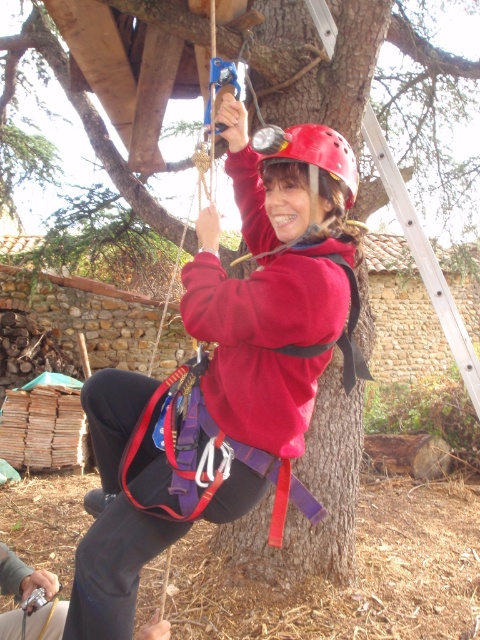
Question: Does matte red jacket at center have a lesser width compared to red matte helmet at center?

Choices:
 (A) yes
 (B) no

Answer: (B)

Question: Does matte red jacket at center have a smaller size compared to red matte helmet at center?

Choices:
 (A) yes
 (B) no

Answer: (B)

Question: Which point is farther to the camera?

Choices:
 (A) (194, 310)
 (B) (351, 193)

Answer: (B)

Question: Is matte red jacket at center below red matte helmet at center?

Choices:
 (A) yes
 (B) no

Answer: (A)

Question: Which point is closer to the camera?

Choices:
 (A) red matte helmet at center
 (B) matte red jacket at center

Answer: (B)

Question: Which point appears closest to the camera in this image?

Choices:
 (A) (299, 310)
 (B) (262, 152)

Answer: (A)